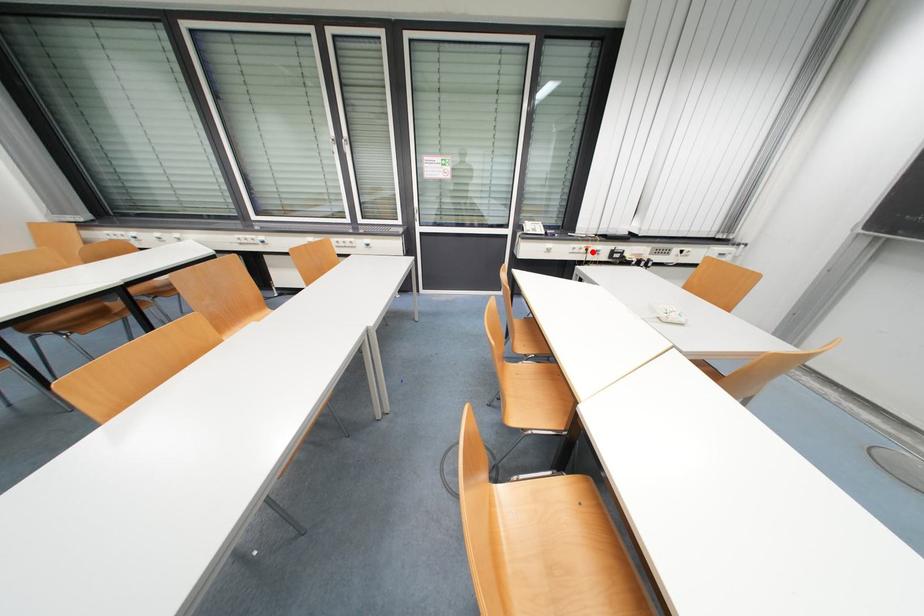
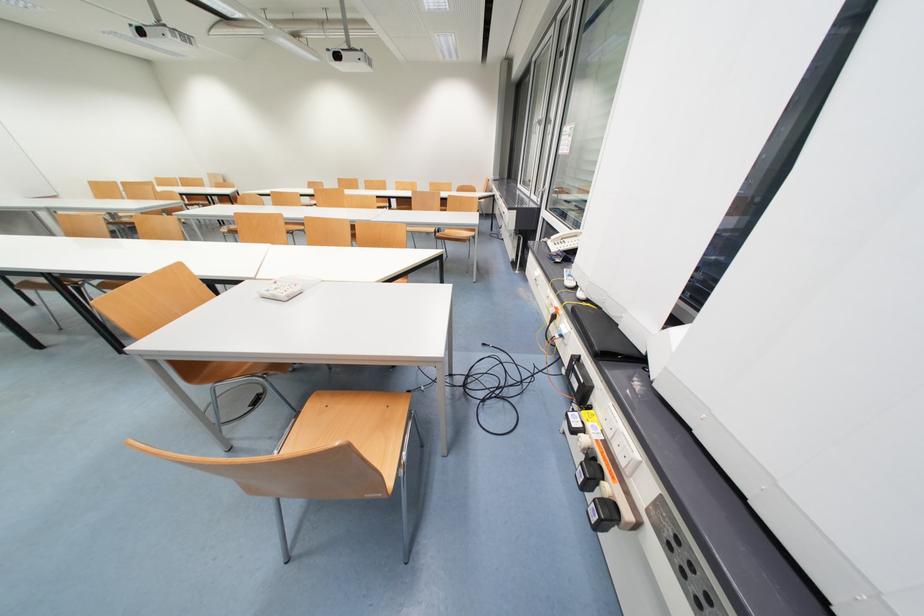
Question: I am providing you with two images of the same scene from different viewpoints. A red point is shown in image1. For the corresponding object point in image2, is it positioned nearer or farther from the camera?

Choices:
 (A) Nearer
 (B) Farther

Answer: (B)